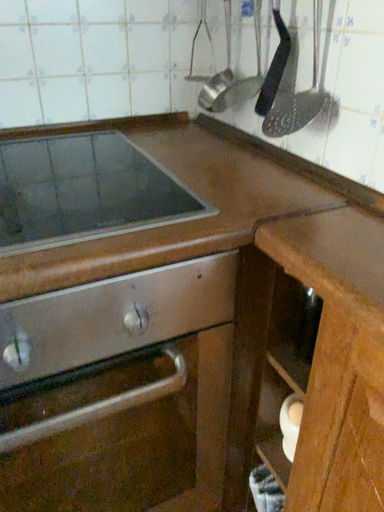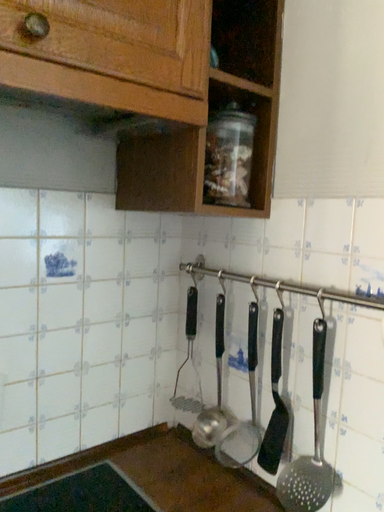
Question: How did the camera likely rotate when shooting the video?

Choices:
 (A) rotated left
 (B) rotated right

Answer: (B)